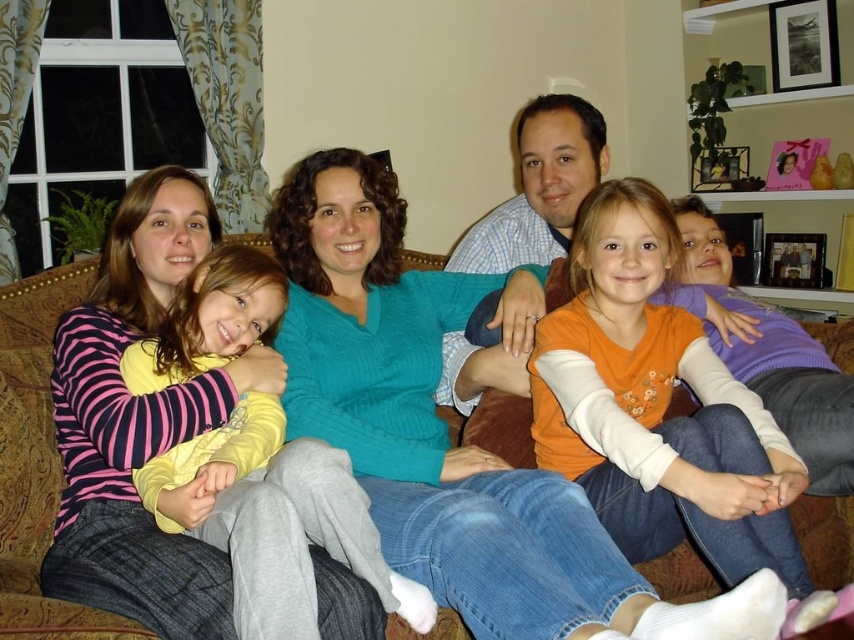
You are designing a layout for a clothing catalog and need to place the orange cotton shirt at center and striped fleece sweater at left in a photo shoot. Based on their heights, which item should be placed higher up in the arrangement?

The orange cotton shirt at center should be placed higher up since it has a greater height compared to the striped fleece sweater at left.